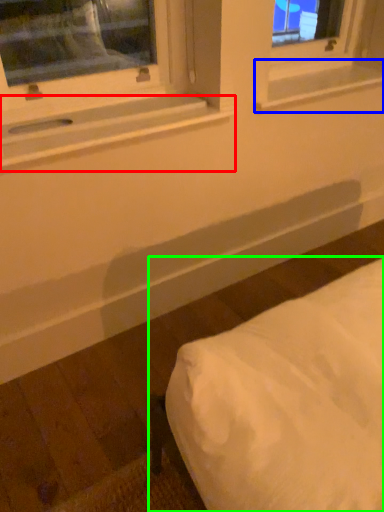
Question: Considering the real-world distances, which object is farthest from window sill (highlighted by a red box)? window sill (highlighted by a blue box) or furniture (highlighted by a green box)?

Choices:
 (A) window sill
 (B) furniture

Answer: (B)